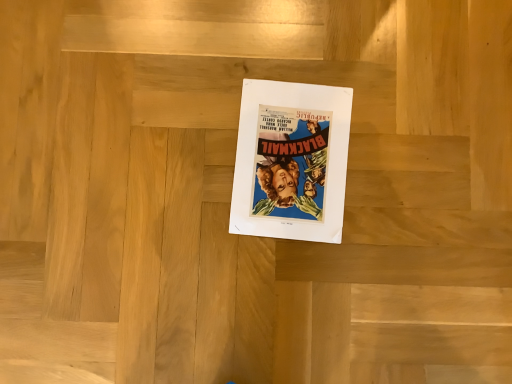
You are a GUI agent. You are given a task and a screenshot of the screen. Output one action in this format:
    pyautogui.click(x=<x>, y=<y>)
    Task: Click on the vacant area on top of matte paper poster at center (from a real-world perspective)
    
    Given the screenshot: What is the action you would take?
    pyautogui.click(x=291, y=157)